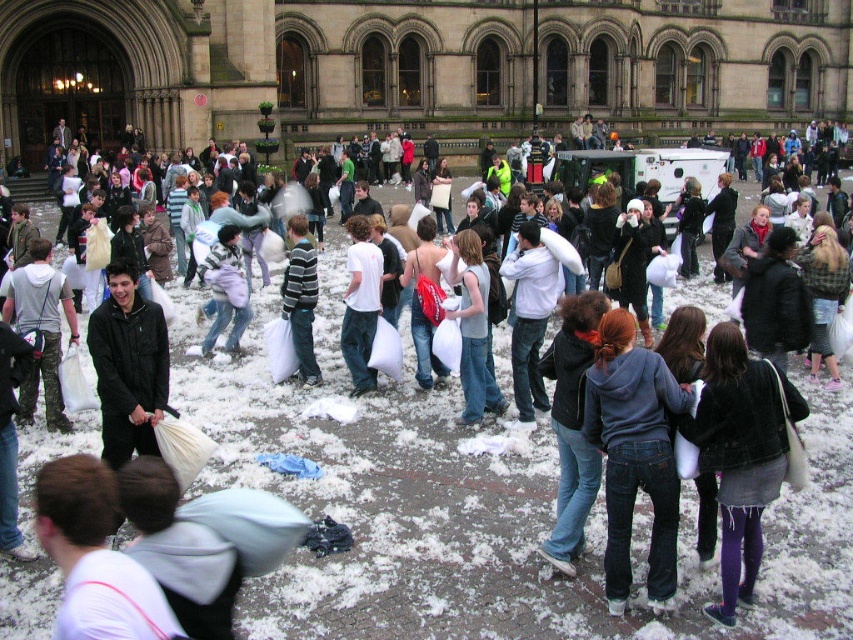
Is denim jeans at center smaller than striped sweater at center?

Yes.

Is denim jeans at center closer to camera compared to striped sweater at center?

Yes, it is in front of striped sweater at center.

Locate an element on the screen. This screenshot has height=640, width=853. denim jeans at center is located at coordinates (634, 454).

Which is below, denim jacket at lower right or striped sweater at center?

denim jacket at lower right is below.

Can you confirm if denim jacket at lower right is bigger than striped sweater at center?

Actually, denim jacket at lower right might be smaller than striped sweater at center.

Is point (747, 548) closer to viewer compared to point (299, 314)?

Yes, it is in front of point (299, 314).

Identify the location of denim jacket at lower right. The height and width of the screenshot is (640, 853). (741, 452).

Measure the distance between point [631,369] and camera.

A distance of 32.57 meters exists between point [631,369] and camera.

Which is above, denim jeans at center or denim jacket at lower right?

Positioned higher is denim jacket at lower right.

Does point (631, 449) come in front of point (752, 368)?

No, it is not.

Where is `denim jeans at center`? The height and width of the screenshot is (640, 853). denim jeans at center is located at coordinates (634, 454).